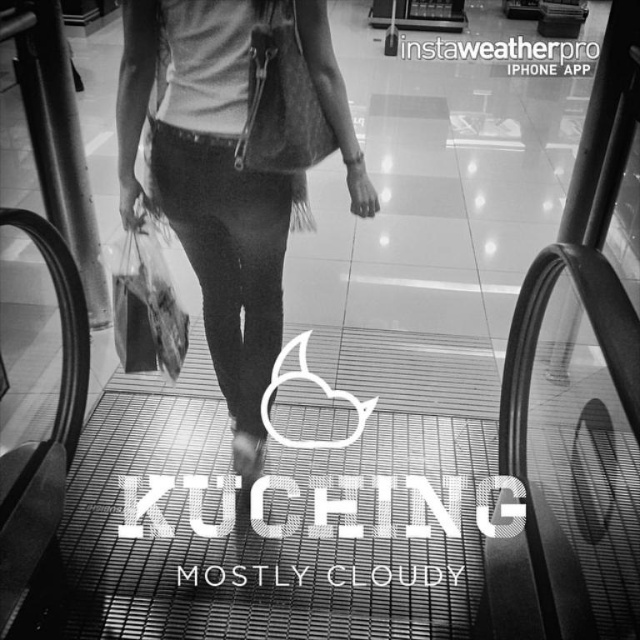
Question: Is suede bag at center to the right of translucent plastic bag at center from the viewer's perspective?

Choices:
 (A) yes
 (B) no

Answer: (A)

Question: Is suede bag at center wider than translucent plastic bag at center?

Choices:
 (A) no
 (B) yes

Answer: (B)

Question: Which point appears farthest from the camera in this image?

Choices:
 (A) tap(189, 211)
 (B) tap(138, 340)

Answer: (B)

Question: Which object is closer to the camera taking this photo?

Choices:
 (A) translucent plastic bag at center
 (B) suede bag at center

Answer: (B)

Question: Does suede bag at center appear on the left side of translucent plastic bag at center?

Choices:
 (A) yes
 (B) no

Answer: (B)